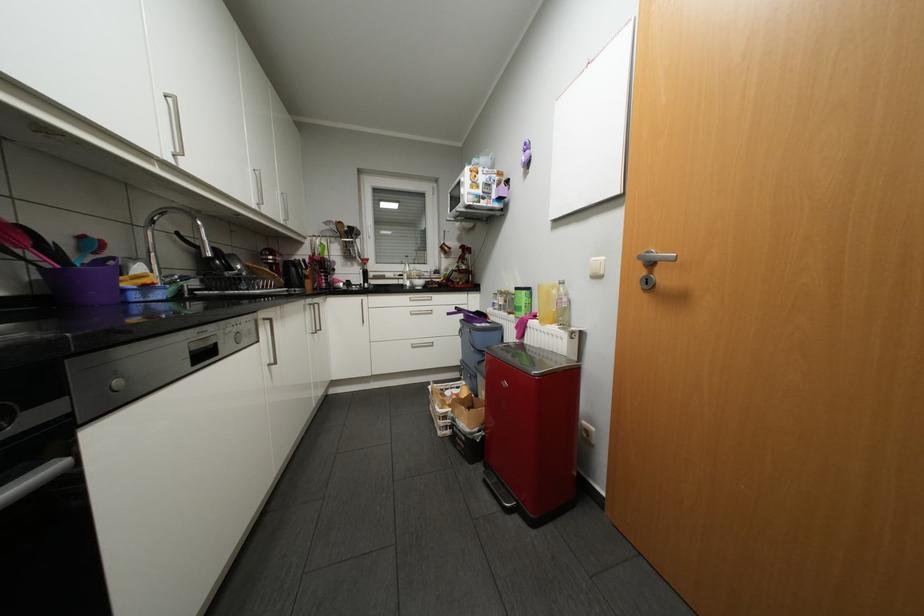
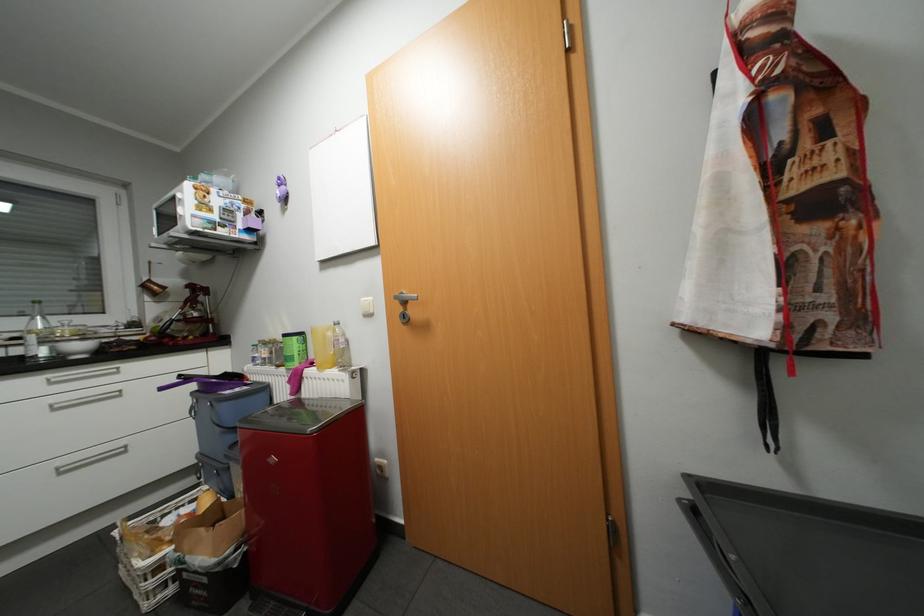
Find the pixel in the second image that matches point (648, 262) in the first image.

(405, 301)